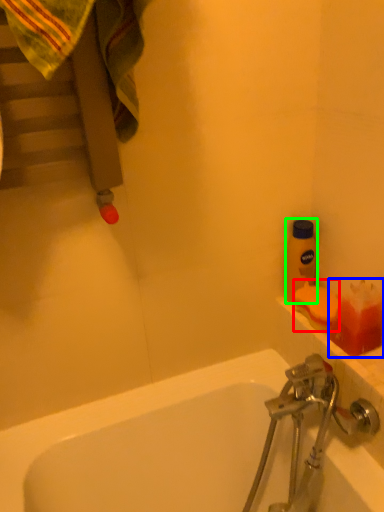
Question: Which object is the farthest from soap (highlighted by a red box)? Choose among these: toiletry (highlighted by a blue box) or bottle (highlighted by a green box).

Choices:
 (A) toiletry
 (B) bottle

Answer: (B)